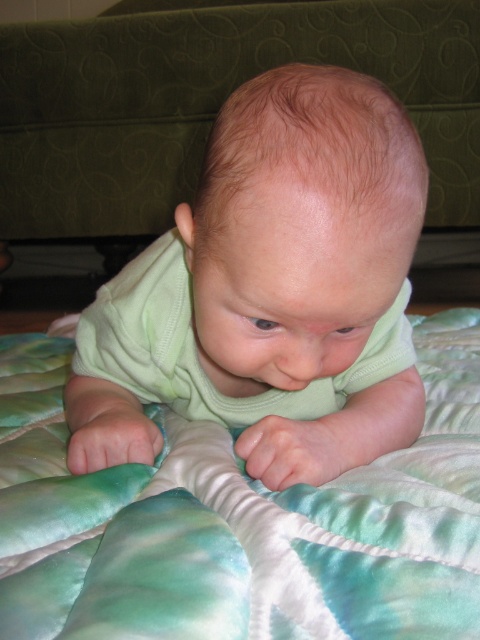
Does green smooth baby at center have a greater height compared to green satin quilt at center?

Correct, green smooth baby at center is much taller as green satin quilt at center.

Is point (269, 106) closer to camera compared to point (372, 586)?

No.

This screenshot has width=480, height=640. I want to click on green smooth baby at center, so click(271, 291).